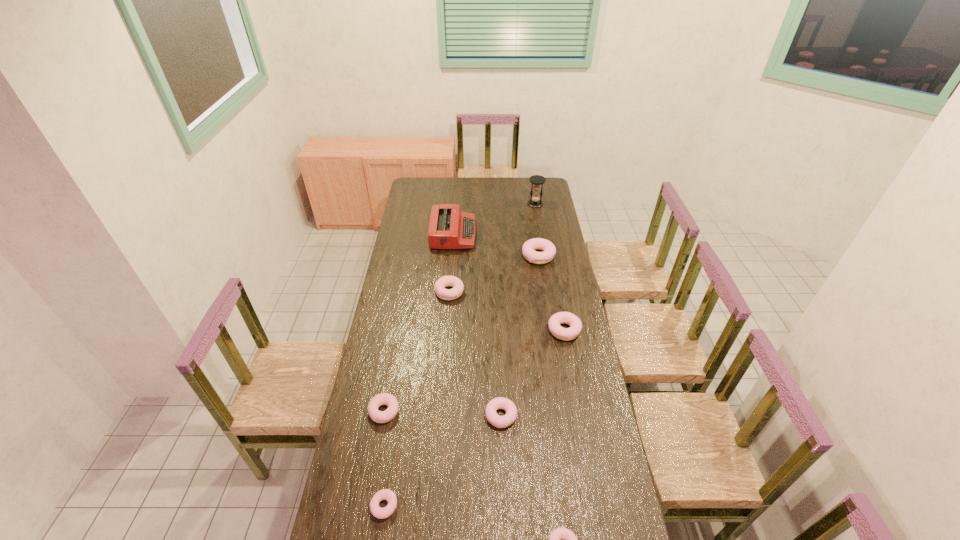
Where is `hourglass`? This screenshot has height=540, width=960. hourglass is located at coordinates (535, 202).

The image size is (960, 540). What are the coordinates of `black hourglass` in the screenshot? It's located at (535, 202).

Where is `red typewriter`? This screenshot has width=960, height=540. red typewriter is located at coordinates (449, 228).

At what (x,y) coordinates should I click in order to perform the action: click on the eighth shortest object. Please return your answer as a coordinate pair (x, y). Looking at the image, I should click on (449, 228).

Locate an element on the screen. Image resolution: width=960 pixels, height=540 pixels. the farthest pink doughnut is located at coordinates (529, 247).

Identify the location of the farthest doughnut. This screenshot has width=960, height=540. (529, 247).

Locate an element on the screen. the farthest purple doughnut is located at coordinates (445, 281).

At what (x,y) coordinates should I click in order to perform the action: click on the rightmost purple doughnut. Please return your answer as a coordinate pair (x, y). This screenshot has height=540, width=960. Looking at the image, I should click on (445, 281).

Identify the location of the third smallest pink doughnut. (566, 334).

The image size is (960, 540). Find the location of `the fifth nearest doughnut`. the fifth nearest doughnut is located at coordinates (566, 334).